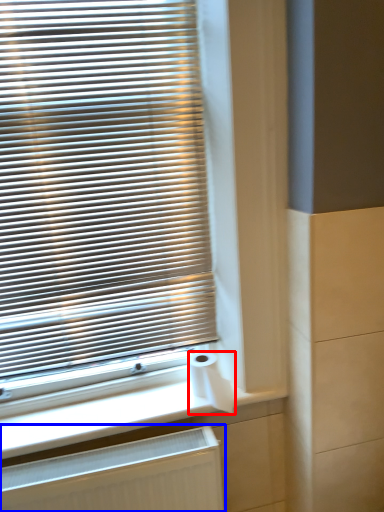
Question: Which object appears farthest to the camera in this image, toilet paper (highlighted by a red box) or radiator (highlighted by a blue box)?

Choices:
 (A) toilet paper
 (B) radiator

Answer: (A)